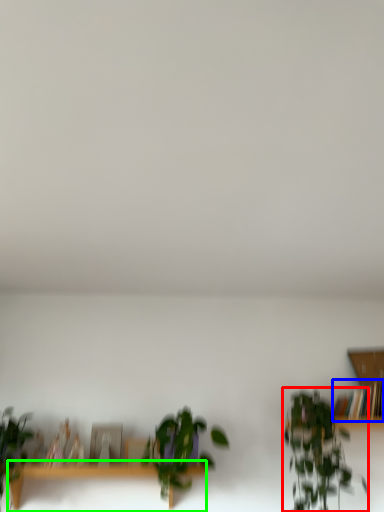
Question: Which object is the farthest from houseplant (highlighted by a red box)? Choose among these: book (highlighted by a blue box) or table (highlighted by a green box).

Choices:
 (A) book
 (B) table

Answer: (B)